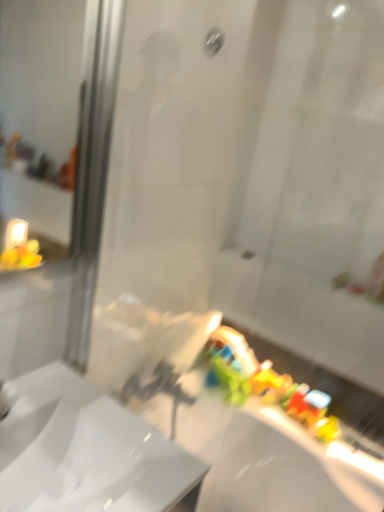
Measure the distance between white glossy bath at lower right and camera.

white glossy bath at lower right and camera are 3.87 feet apart from each other.

Identify the location of matte silver shower at upper center. (213, 41).

Find the location of a particular element. Image resolution: width=384 pixels, height=512 pixels. white glossy sink at center is located at coordinates (86, 451).

Considering the sizes of white glossy bath at lower right and white glossy sink at center in the image, is white glossy bath at lower right taller or shorter than white glossy sink at center?

Clearly, white glossy bath at lower right is taller compared to white glossy sink at center.

Between white glossy bath at lower right and white glossy sink at center, which one appears on the left side from the viewer's perspective?

Positioned to the left is white glossy sink at center.

Is white glossy bath at lower right positioned before white glossy sink at center?

No, white glossy bath at lower right is further to the viewer.

Is white glossy bath at lower right located outside white glossy sink at center?

Yes, white glossy bath at lower right is outside of white glossy sink at center.

Which object is thinner, matte silver shower at upper center or white glossy bath at lower right?

With smaller width is matte silver shower at upper center.

Considering the sizes of objects matte silver shower at upper center and white glossy bath at lower right in the image provided, who is taller, matte silver shower at upper center or white glossy bath at lower right?

With more height is white glossy bath at lower right.

Is matte silver shower at upper center situated inside white glossy bath at lower right or outside?

matte silver shower at upper center is outside white glossy bath at lower right.

Is matte silver shower at upper center oriented towards white glossy bath at lower right?

No, matte silver shower at upper center does not turn towards white glossy bath at lower right.

Which of these two, white glossy bath at lower right or matte silver shower at upper center, is wider?

white glossy bath at lower right is wider.

Visually, is white glossy bath at lower right positioned to the left or to the right of matte silver shower at upper center?

white glossy bath at lower right is positioned on matte silver shower at upper center's right side.

Is white glossy bath at lower right inside or outside of matte silver shower at upper center?

white glossy bath at lower right is not enclosed by matte silver shower at upper center.

From a real-world perspective, does white glossy bath at lower right stand above matte silver shower at upper center?

No, from a real-world perspective, white glossy bath at lower right is not on top of matte silver shower at upper center.

From the image's perspective, would you say matte silver shower at upper center is shown under white glossy sink at center?

No, from the image's perspective, matte silver shower at upper center is not beneath white glossy sink at center.

Between point (206, 45) and point (79, 485), which one is positioned in front?

The point (79, 485) is closer to the camera.

Can you confirm if matte silver shower at upper center is positioned to the right of white glossy sink at center?

Yes, matte silver shower at upper center is to the right of white glossy sink at center.

Is matte silver shower at upper center bigger or smaller than white glossy sink at center?

In the image, matte silver shower at upper center appears to be smaller than white glossy sink at center.

This screenshot has width=384, height=512. I want to click on bath below the white glossy sink at center (from the image's perspective), so click(x=271, y=459).

Is white glossy sink at center in contact with white glossy bath at lower right?

No, white glossy sink at center is not with white glossy bath at lower right.

From a real-world perspective, does white glossy sink at center stand above white glossy bath at lower right?

Yes, from a real-world perspective, white glossy sink at center is over white glossy bath at lower right

Is white glossy sink at center bigger than white glossy bath at lower right?

Incorrect, white glossy sink at center is not larger than white glossy bath at lower right.

Who is smaller, white glossy sink at center or matte silver shower at upper center?

matte silver shower at upper center is smaller.

Is matte silver shower at upper center located within white glossy sink at center?

Definitely not — matte silver shower at upper center is not inside white glossy sink at center.

Which is behind, white glossy sink at center or matte silver shower at upper center?

matte silver shower at upper center is behind.

From a real-world perspective, between white glossy sink at center and matte silver shower at upper center, who is vertically lower?

In real-world perspective, white glossy sink at center is lower.

I want to click on bath that appears below the white glossy sink at center (from the image's perspective), so click(271, 459).

Identify the location of shower behind the white glossy bath at lower right. The image size is (384, 512). (213, 41).

Estimate the real-world distances between objects in this image. Which object is closer to white glossy bath at lower right, matte silver shower at upper center or white glossy sink at center?

Among the two, white glossy sink at center is located nearer to white glossy bath at lower right.

Estimate the real-world distances between objects in this image. Which object is closer to white glossy sink at center, matte silver shower at upper center or white glossy bath at lower right?

white glossy bath at lower right is closer to white glossy sink at center.

When comparing their distances from matte silver shower at upper center, does white glossy bath at lower right or white glossy sink at center seem further?

Based on the image, white glossy bath at lower right appears to be further to matte silver shower at upper center.

Considering their positions, is white glossy sink at center positioned closer to white glossy bath at lower right than matte silver shower at upper center?

Based on the image, white glossy sink at center appears to be nearer to white glossy bath at lower right.

Looking at the image, which one is located closer to matte silver shower at upper center, white glossy sink at center or white glossy bath at lower right?

white glossy sink at center is closer to matte silver shower at upper center.

From the image, which object appears to be farther from white glossy sink at center, white glossy bath at lower right or matte silver shower at upper center?

matte silver shower at upper center.

Where is `sink between matte silver shower at upper center and white glossy bath at lower right in the up-down direction`? The width and height of the screenshot is (384, 512). sink between matte silver shower at upper center and white glossy bath at lower right in the up-down direction is located at coordinates (86, 451).